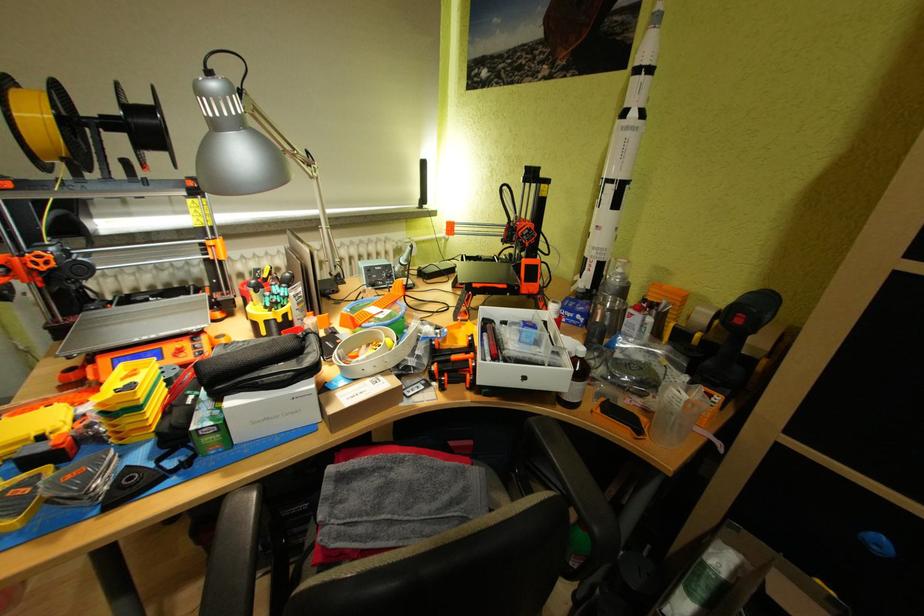
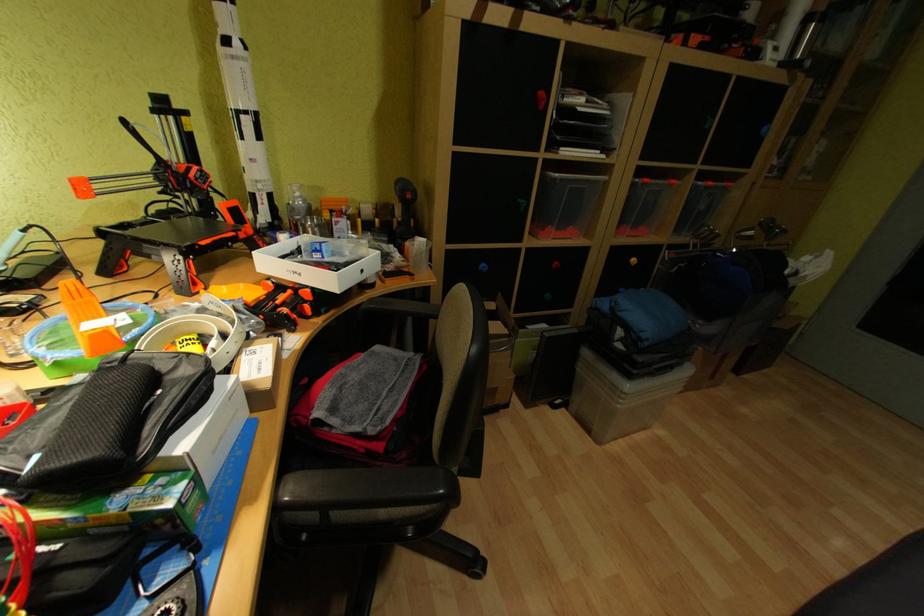
First-person continuous shooting, in which direction is the camera rotating?

The camera rotated toward right-down.